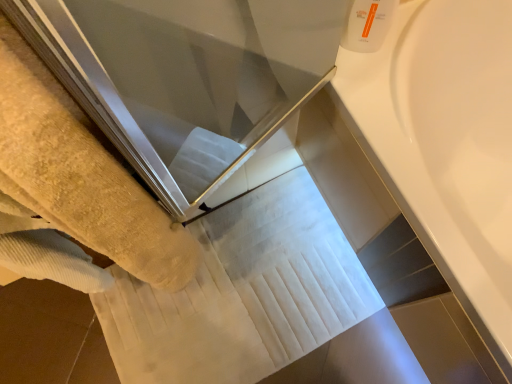
Question: Is yellow terry towel at left smaller than white plastic bottle at upper right?

Choices:
 (A) yes
 (B) no

Answer: (B)

Question: Would you say yellow terry towel at left is a long distance from white plastic bottle at upper right?

Choices:
 (A) yes
 (B) no

Answer: (B)

Question: Can you confirm if yellow terry towel at left is shorter than white plastic bottle at upper right?

Choices:
 (A) yes
 (B) no

Answer: (B)

Question: Can you confirm if yellow terry towel at left is wider than white plastic bottle at upper right?

Choices:
 (A) no
 (B) yes

Answer: (B)

Question: Can you confirm if yellow terry towel at left is positioned to the left of white plastic bottle at upper right?

Choices:
 (A) no
 (B) yes

Answer: (B)

Question: Is point (461, 56) positioned closer to the camera than point (357, 18)?

Choices:
 (A) closer
 (B) farther

Answer: (B)

Question: From the image's perspective, is white glossy bathtub at upper right above or below white plastic bottle at upper right?

Choices:
 (A) below
 (B) above

Answer: (A)

Question: Based on their positions, is white glossy bathtub at upper right located to the left or right of white plastic bottle at upper right?

Choices:
 (A) right
 (B) left

Answer: (A)

Question: Is white glossy bathtub at upper right inside or outside of white plastic bottle at upper right?

Choices:
 (A) inside
 (B) outside

Answer: (B)

Question: From the image's perspective, is yellow terry towel at left above or below white glossy bathtub at upper right?

Choices:
 (A) above
 (B) below

Answer: (B)

Question: Considering the positions of point (5, 31) and point (497, 291), is point (5, 31) closer or farther from the camera than point (497, 291)?

Choices:
 (A) closer
 (B) farther

Answer: (A)

Question: Based on their positions, is yellow terry towel at left located to the left or right of white glossy bathtub at upper right?

Choices:
 (A) right
 (B) left

Answer: (B)

Question: Considering their positions, is yellow terry towel at left located in front of or behind white glossy bathtub at upper right?

Choices:
 (A) front
 (B) behind

Answer: (A)

Question: In terms of width, does white plastic bottle at upper right look wider or thinner when compared to yellow terry towel at left?

Choices:
 (A) wide
 (B) thin

Answer: (B)

Question: From a real-world perspective, relative to yellow terry towel at left, is white plastic bottle at upper right vertically above or below?

Choices:
 (A) above
 (B) below

Answer: (A)